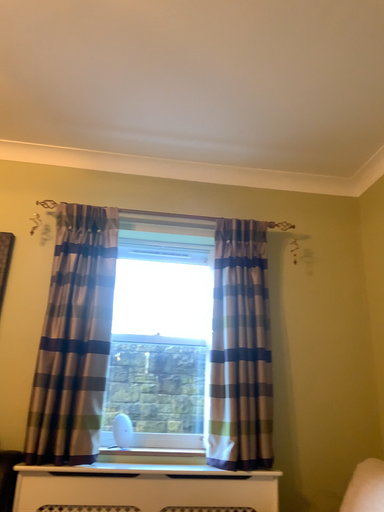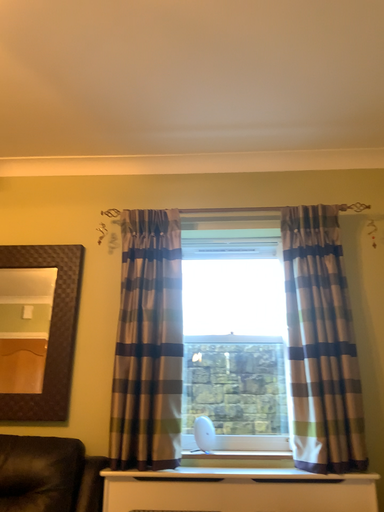
Question: How did the camera likely rotate when shooting the video?

Choices:
 (A) rotated right
 (B) rotated left

Answer: (B)